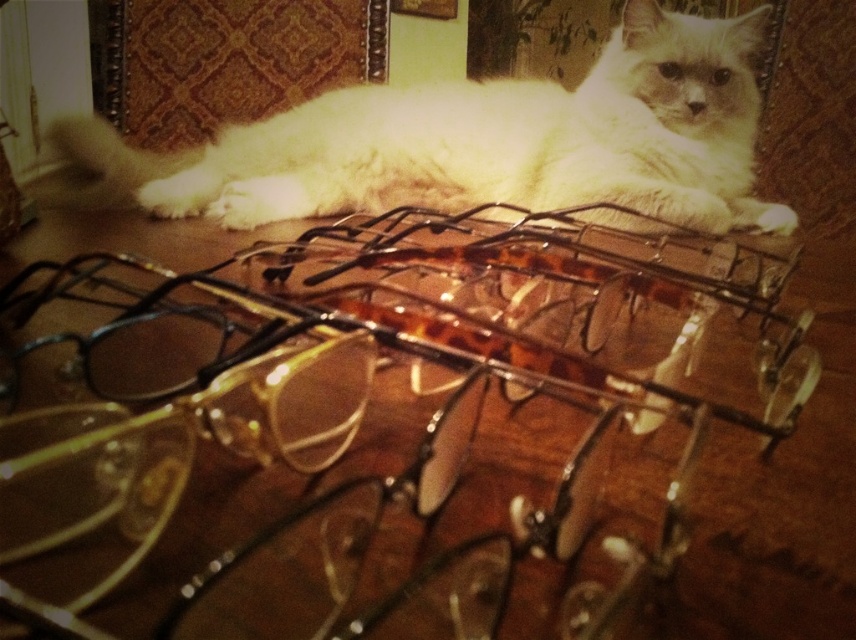
This screenshot has height=640, width=856. I want to click on transparent plastic glasses at center, so click(438, 467).

Between point (824, 413) and point (758, 96), which one is positioned behind?

The point (758, 96) is more distant.

Is point (152, 445) farther from camera compared to point (601, 172)?

No, (152, 445) is in front of (601, 172).

The height and width of the screenshot is (640, 856). In order to click on transparent plastic glasses at center in this screenshot , I will do `click(438, 467)`.